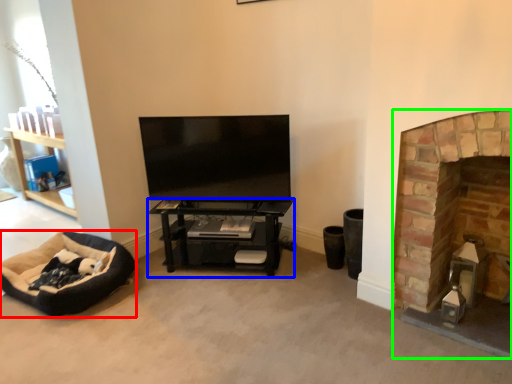
Question: Which is farther away from dog bed (highlighted by a red box)? shelf (highlighted by a blue box) or fireplace (highlighted by a green box)?

Choices:
 (A) shelf
 (B) fireplace

Answer: (B)